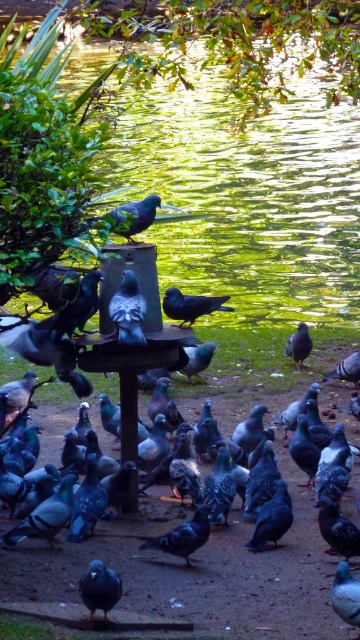
From the picture: You are a photographer aiming to capture a closeup of the metallic blue bird at center and the shiny gray pigeon at center. Which bird should you zoom in on to get a clearer image without moving your camera?

The metallic blue bird at center is larger in size than the shiny gray pigeon at center, so you should zoom in on the metallic blue bird at center to get a clearer image without moving your camera because its larger size will fill the frame better.

You are standing at the edge of the pond and want to know which of the two points, point (194, 518) or point (214, 492), is closer to you. Based on the scene description, can you determine which point is nearer?

Point (194, 518) is closer to the viewer than point (214, 492).